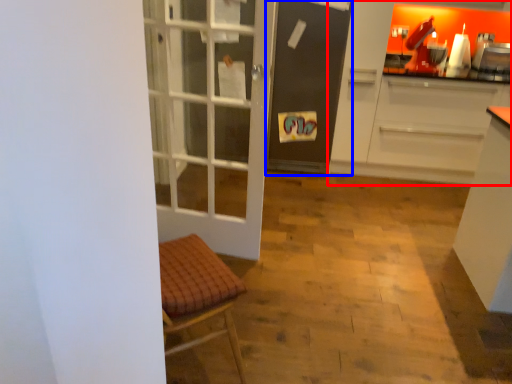
Question: Which of the following is the closest to the observer, cabinetry (highlighted by a red box) or screen door (highlighted by a blue box)?

Choices:
 (A) cabinetry
 (B) screen door

Answer: (A)